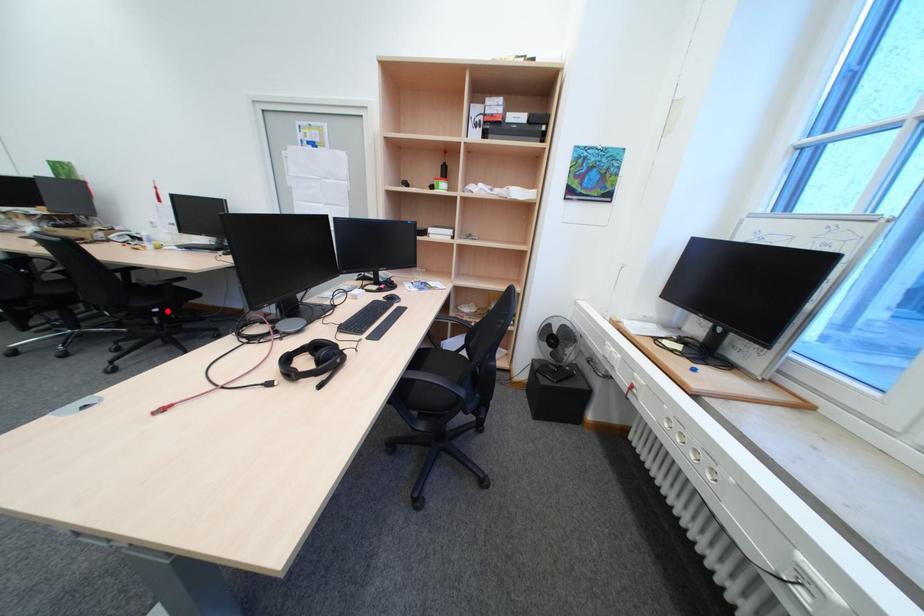
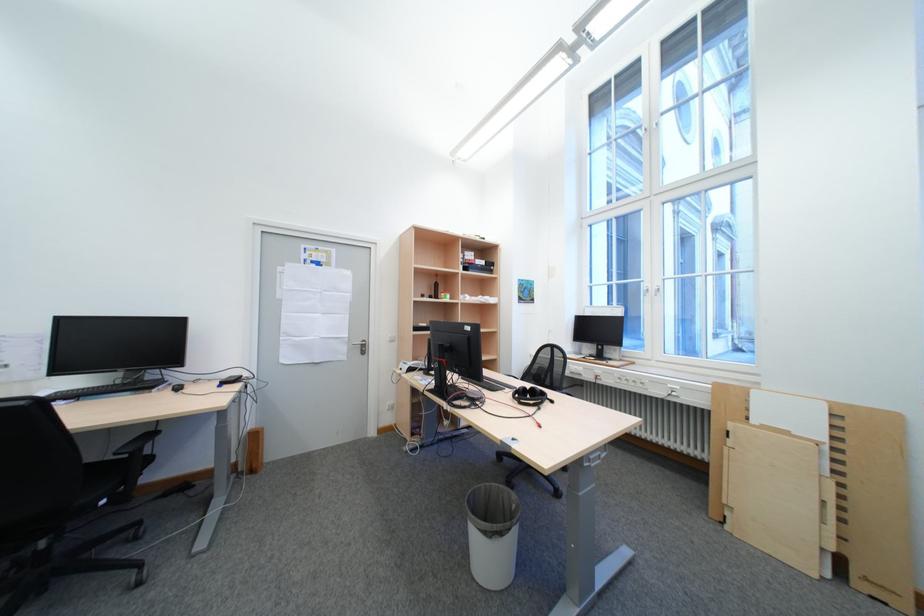
Question: I am providing you with two images of the same scene from different viewpoints. Image1 has a red point marked. In image2, the corresponding 3D location appears at what relative position? Reply with the corresponding letter.

Choices:
 (A) Closer
 (B) Farther

Answer: (A)